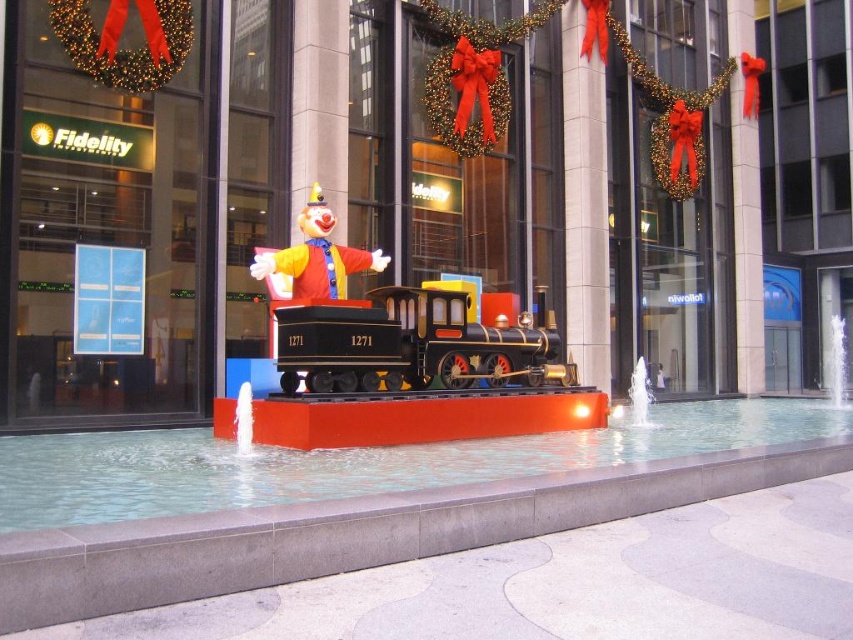
Does metallic clown at center have a larger size compared to matte clown at center?

Correct, metallic clown at center is larger in size than matte clown at center.

Is point (798, 189) positioned in front of point (321, 216)?

No, it is behind (321, 216).

This screenshot has width=853, height=640. In order to click on metallic clown at center in this screenshot , I will do `click(338, 202)`.

Measure the distance between shiny black locomotive at center and matte clown at center.

shiny black locomotive at center is 4.87 feet from matte clown at center.

What do you see at coordinates (409, 344) in the screenshot? This screenshot has width=853, height=640. I see `shiny black locomotive at center` at bounding box center [409, 344].

Who is more forward, (410, 298) or (256, 268)?

Point (256, 268) is in front.

Locate an element on the screen. This screenshot has width=853, height=640. shiny black locomotive at center is located at coordinates (409, 344).

Is metallic clown at center positioned in front of shiny black locomotive at center?

No, metallic clown at center is further to the viewer.

Between metallic clown at center and shiny black locomotive at center, which one has more height?

With more height is metallic clown at center.

The height and width of the screenshot is (640, 853). What are the coordinates of `metallic clown at center` in the screenshot? It's located at (338, 202).